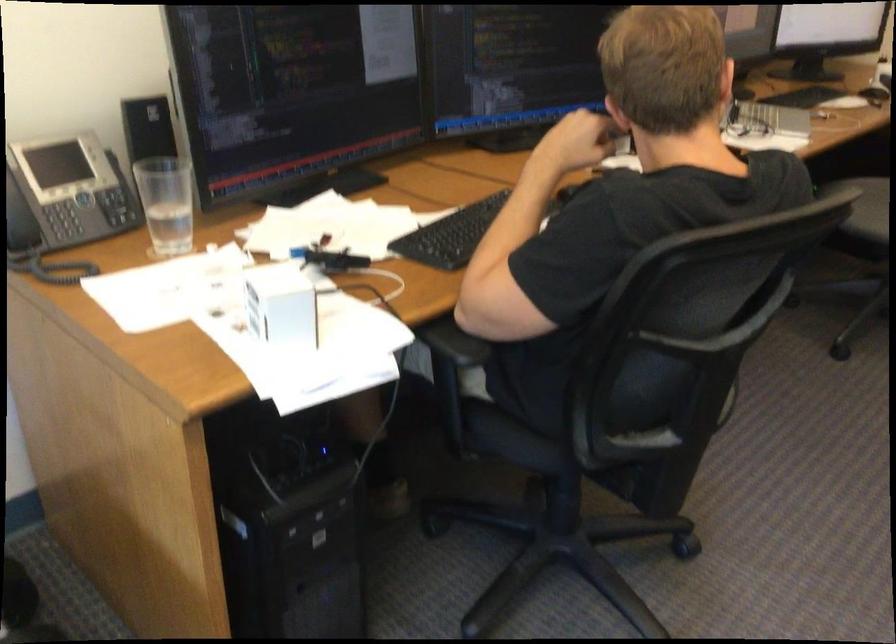
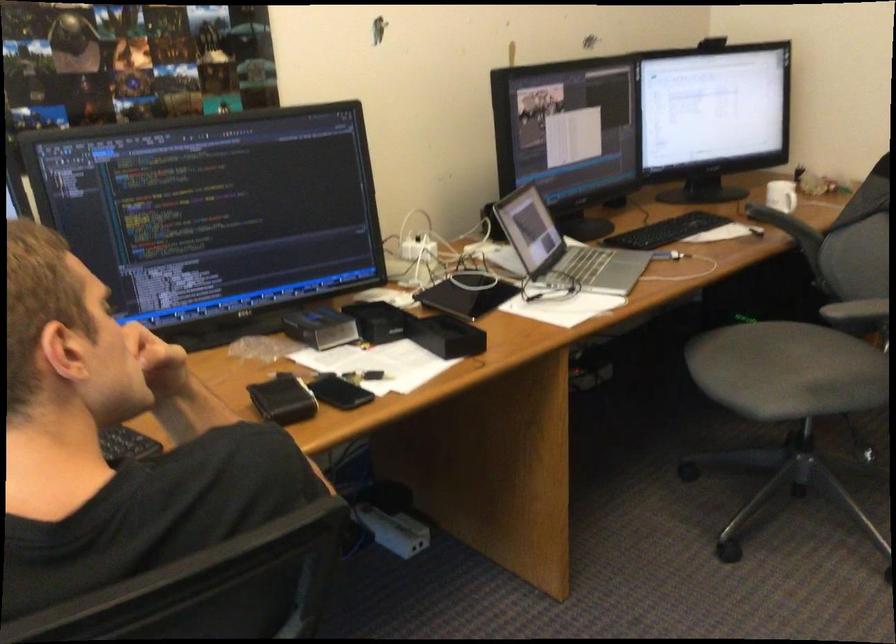
The images are taken continuously from a first-person perspective. In which direction are you moving?

The movement direction of the cameraman is right, forward.